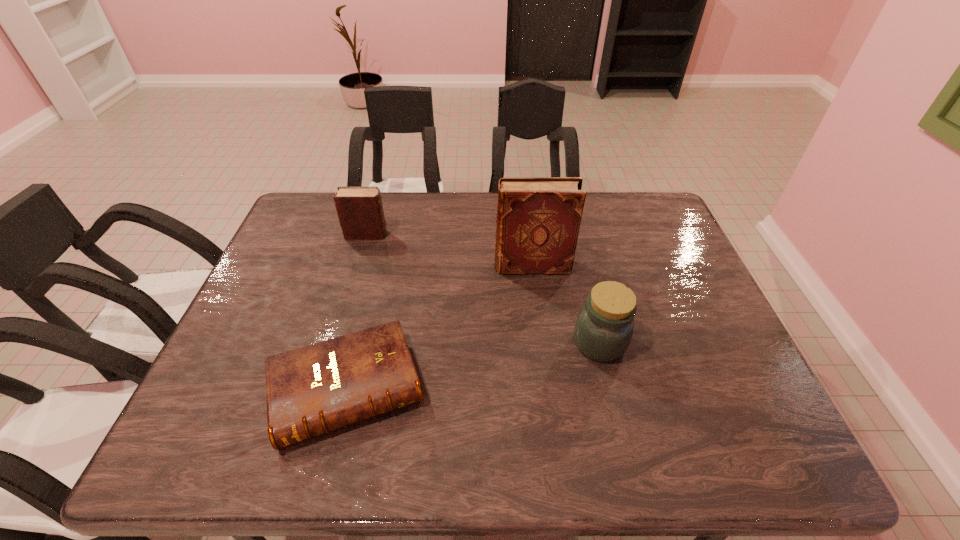
Locate an element on the screen. The height and width of the screenshot is (540, 960). vacant space at the far right corner of the desktop is located at coordinates (619, 194).

This screenshot has height=540, width=960. Find the location of `free space at the near right corner of the desktop`. free space at the near right corner of the desktop is located at coordinates (774, 431).

Image resolution: width=960 pixels, height=540 pixels. What are the coordinates of `vacant area between the jar and the left hardback book` in the screenshot? It's located at (473, 366).

Locate an element on the screen. empty space that is in between the tallest object and the diary is located at coordinates (449, 251).

This screenshot has height=540, width=960. In order to click on empty location between the diary and the left hardback book in this screenshot , I will do `click(357, 312)`.

You are a GUI agent. You are given a task and a screenshot of the screen. Output one action in this format:
    pyautogui.click(x=<x>, y=<y>)
    Task: Click on the unoccupied position between the shorter hardback book and the farthest object
    Image resolution: width=960 pixels, height=540 pixels.
    Given the screenshot: What is the action you would take?
    pyautogui.click(x=357, y=312)

Where is `empty space that is in between the farther hardback book and the jar`? This screenshot has height=540, width=960. empty space that is in between the farther hardback book and the jar is located at coordinates (565, 305).

I want to click on unoccupied area between the nearer hardback book and the jar, so click(473, 366).

The height and width of the screenshot is (540, 960). I want to click on vacant region between the shorter hardback book and the second farthest object, so click(x=440, y=328).

Find the location of a particular element. This screenshot has width=960, height=540. free area in between the shorter hardback book and the taller hardback book is located at coordinates (440, 328).